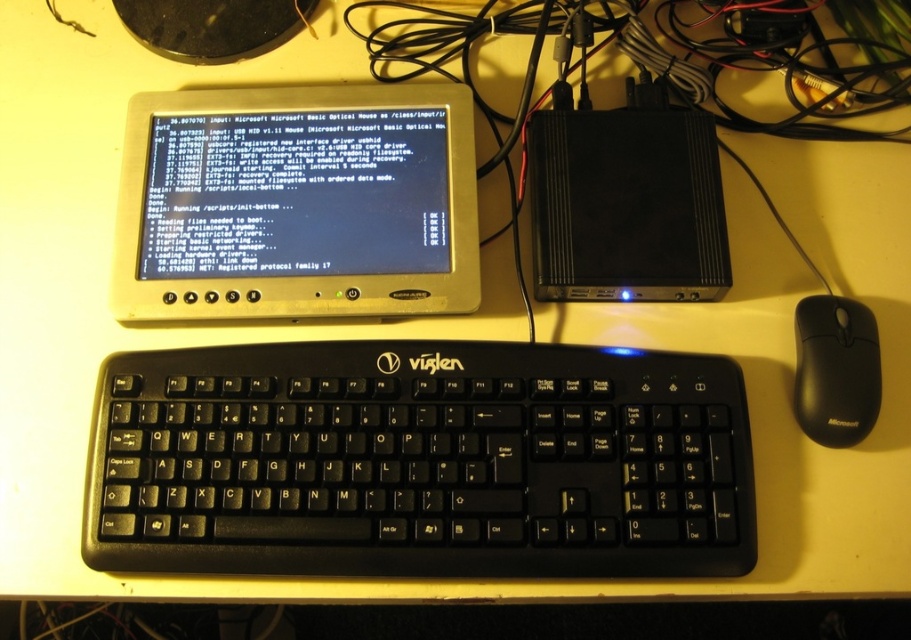
Question: Can you confirm if black plastic keyboard at center is positioned to the right of black plastic mouse at lower right?

Choices:
 (A) no
 (B) yes

Answer: (A)

Question: Which object is the closest to the black plastic mouse at lower right?

Choices:
 (A) metallic silver monitor at center
 (B) black plastic keyboard at center

Answer: (B)

Question: Which of these objects is positioned farthest from the black plastic mouse at lower right?

Choices:
 (A) metallic silver monitor at center
 (B) black plastic keyboard at center

Answer: (A)

Question: Is black plastic keyboard at center to the left of black plastic mouse at lower right from the viewer's perspective?

Choices:
 (A) yes
 (B) no

Answer: (A)

Question: Is metallic silver monitor at center thinner than black plastic mouse at lower right?

Choices:
 (A) no
 (B) yes

Answer: (A)

Question: Which point is closer to the camera?

Choices:
 (A) black plastic keyboard at center
 (B) metallic silver monitor at center
 (C) black plastic mouse at lower right

Answer: (A)